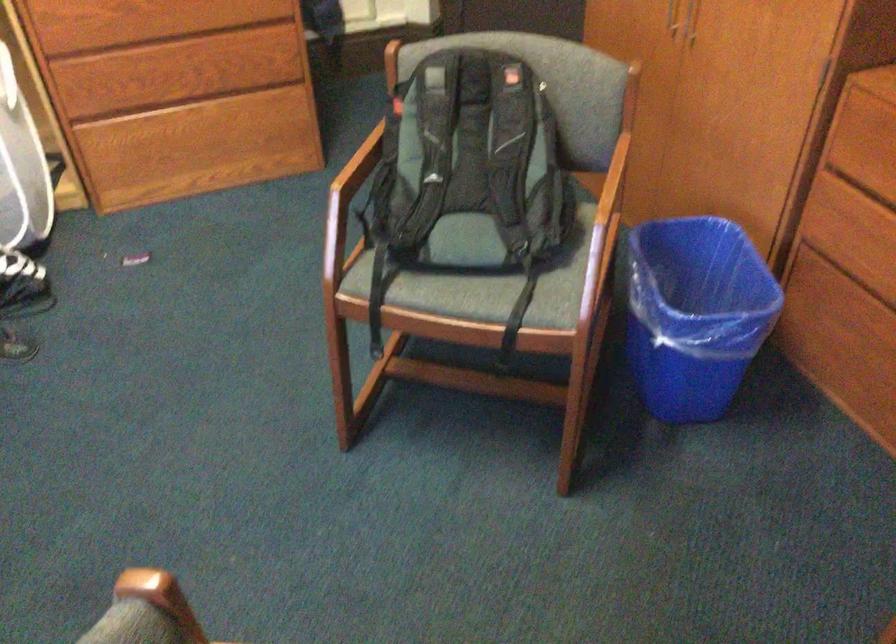
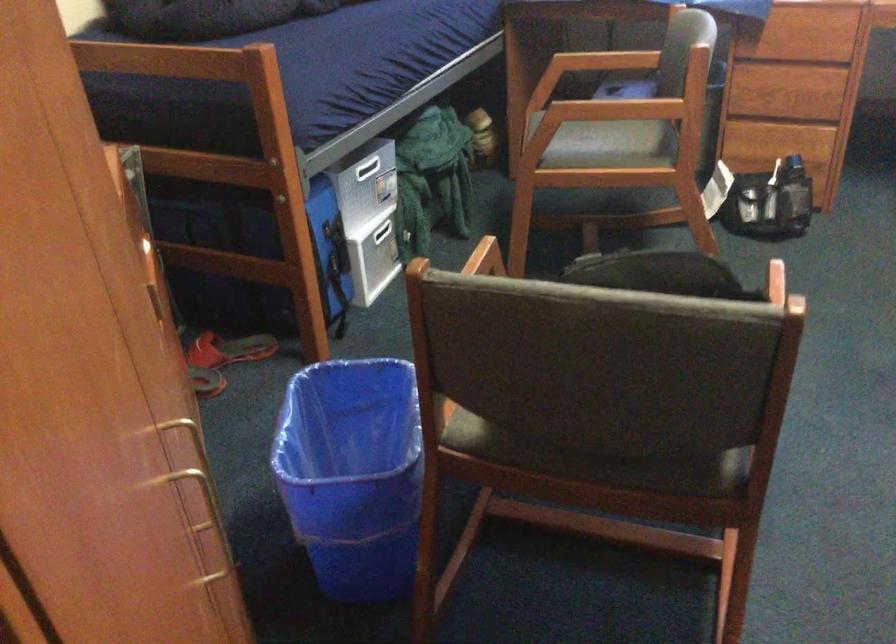
Question: I am providing you with two images of the same scene from different viewpoints. After the viewpoint changes to image2, which objects are now occluded?

Choices:
 (A) drawer pull
 (B) wall flush button
 (C) drawer handle
 (D) black bag

Answer: (C)